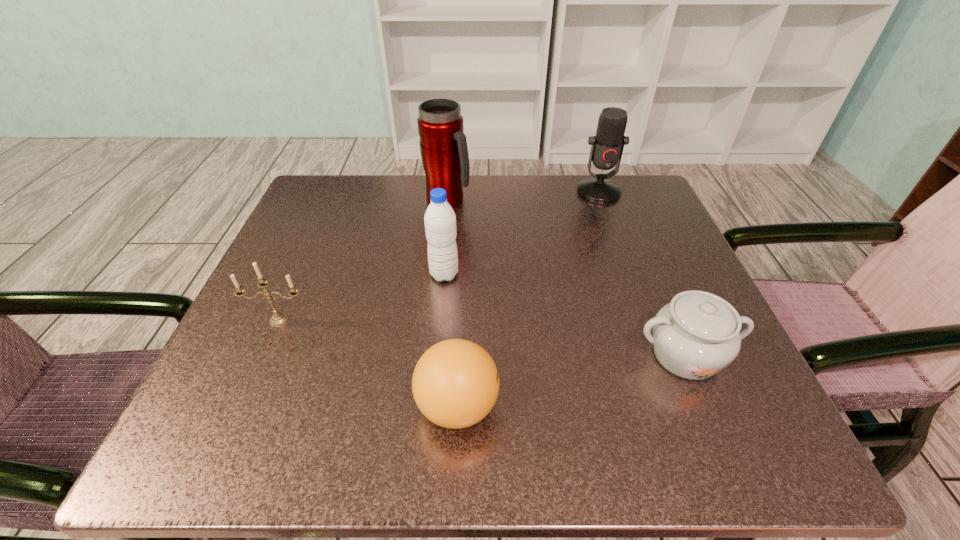
The width and height of the screenshot is (960, 540). Find the location of `free space at the near edge of the desktop`. free space at the near edge of the desktop is located at coordinates (354, 441).

The height and width of the screenshot is (540, 960). Identify the location of vacant area at the left edge of the desktop. (302, 253).

Locate an element on the screen. vacant space at the right edge of the desktop is located at coordinates (666, 392).

Locate an element on the screen. The height and width of the screenshot is (540, 960). vacant space at the far left corner is located at coordinates (358, 214).

Identify the location of blank space at the near left corner of the desktop. This screenshot has width=960, height=540. (204, 404).

Image resolution: width=960 pixels, height=540 pixels. Identify the location of free region at the far right corner of the desktop. (637, 214).

Where is `vacant space at the near right corner of the desktop`? The height and width of the screenshot is (540, 960). vacant space at the near right corner of the desktop is located at coordinates (688, 435).

Locate an element on the screen. Image resolution: width=960 pixels, height=540 pixels. free spot between the leftmost object and the water bottle is located at coordinates (362, 297).

Locate an element on the screen. vacant area that lies between the thermos bottle and the ping-pong ball is located at coordinates (452, 303).

Where is `vacant area between the third farthest object and the microphone`? vacant area between the third farthest object and the microphone is located at coordinates (521, 233).